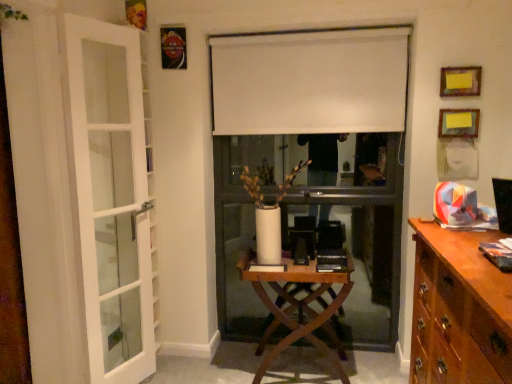
Question: Visually, is brown wood cabinet at right positioned to the left or to the right of wooden picture frame at upper right, which ranks as the 1th picture frame in bottom-to-top order?

Choices:
 (A) left
 (B) right

Answer: (A)

Question: Considering the positions of brown wood cabinet at right and wooden picture frame at upper right, which is the second picture frame from top to bottom, in the image, is brown wood cabinet at right taller or shorter than wooden picture frame at upper right, which is the second picture frame from top to bottom,?

Choices:
 (A) tall
 (B) short

Answer: (A)

Question: Which of these objects is positioned farthest from the white matte curtain at center?

Choices:
 (A) wooden picture frame at upper right, which appears as the 2th picture frame when ordered from the bottom
 (B) white glass door at left
 (C) wooden at center
 (D) brown wood cabinet at right
 (E) wooden picture frame at upper right, which is the second picture frame from top to bottom

Answer: (D)

Question: Based on their relative distances, which object is nearer to the brown wood cabinet at right?

Choices:
 (A) wooden at center
 (B) white matte curtain at center
 (C) wooden picture frame at upper right, which is the 1th picture frame in top-to-bottom order
 (D) wooden picture frame at upper right, which is the second picture frame from top to bottom
 (E) white glass door at left

Answer: (A)